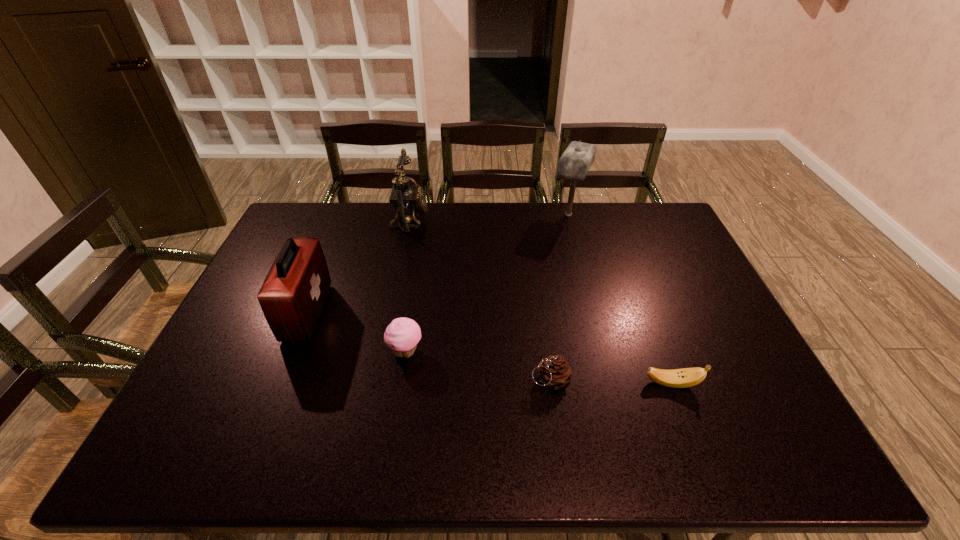
The image size is (960, 540). In order to click on free space located 0.210m on the left of the cupcake in this screenshot , I will do `click(308, 352)`.

I want to click on vacant space situated 0.190m with a leaf charm attached to the pinecone, so click(453, 380).

Where is `free point located with a leaf charm attached to the pinecone`? free point located with a leaf charm attached to the pinecone is located at coordinates (376, 380).

The image size is (960, 540). Identify the location of vacant space located 0.150m with a leaf charm attached to the pinecone. (469, 380).

Where is `free location located on the right of the rightmost object`? The image size is (960, 540). free location located on the right of the rightmost object is located at coordinates (752, 383).

Identify the location of mallet positioned at the far edge. This screenshot has width=960, height=540. (574, 164).

Locate an element on the screen. The image size is (960, 540). telephone present at the far edge is located at coordinates (405, 198).

The height and width of the screenshot is (540, 960). What are the coordinates of `object that is positioned at the left edge` in the screenshot? It's located at (293, 294).

I want to click on object that is at the right edge, so click(678, 378).

Identify the location of vacant space at the far edge. The image size is (960, 540). (476, 238).